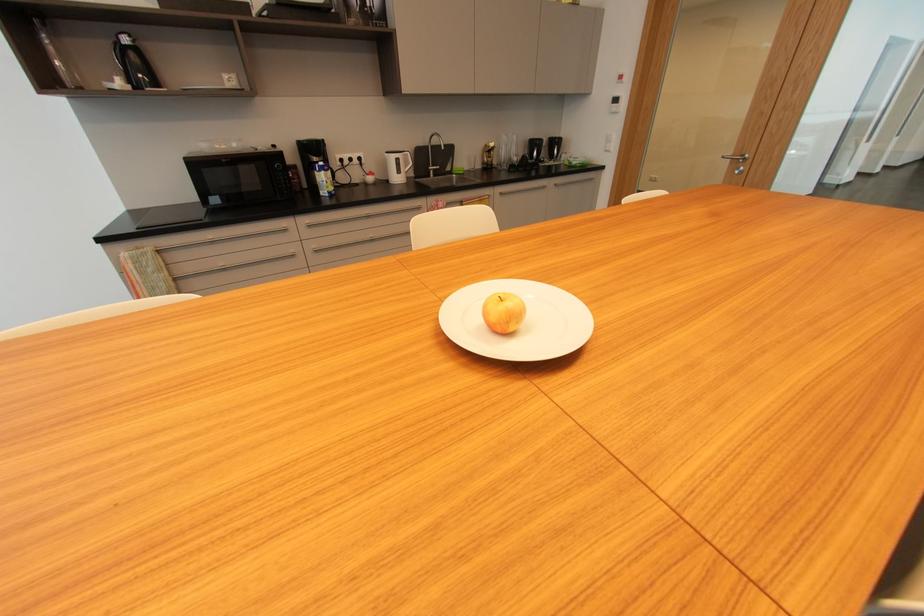
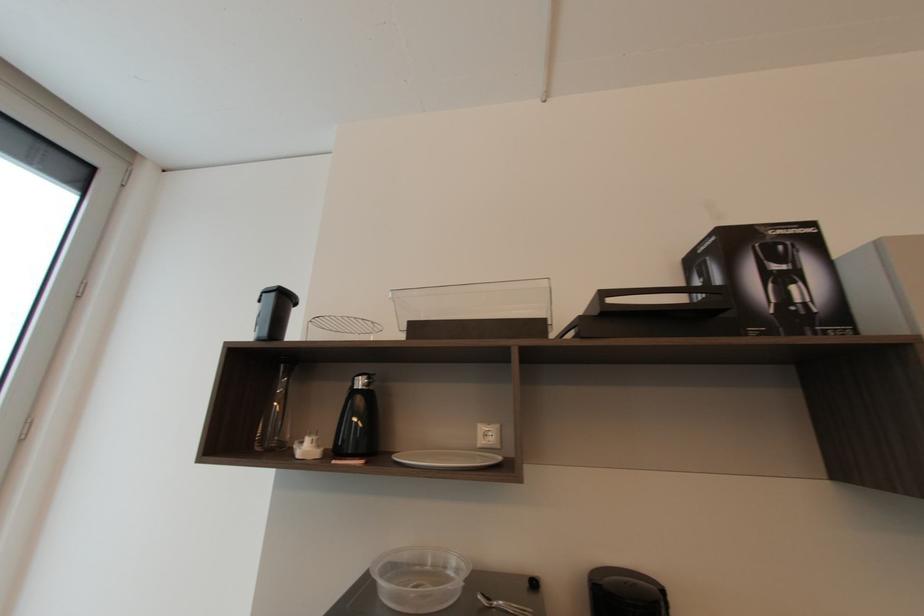
The point at (128,41) is marked in the first image. Where is the corresponding point in the second image?

(362, 384)